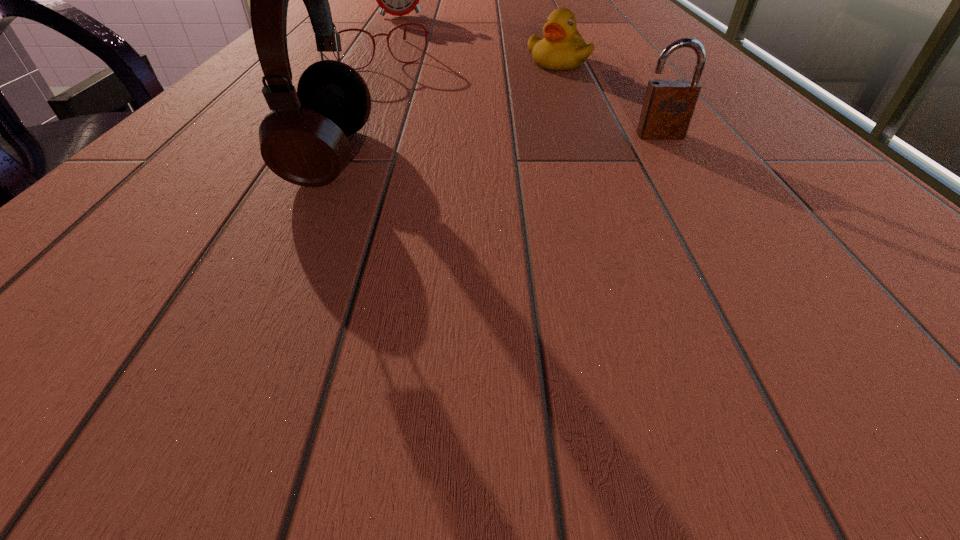
Locate an element on the screen. This screenshot has height=540, width=960. object that is at the right edge is located at coordinates (669, 104).

Locate an element on the screen. vacant space at the far edge of the desktop is located at coordinates (574, 3).

The image size is (960, 540). In the image, there is a desktop. In order to click on vacant space at the near edge in this screenshot , I will do `click(235, 255)`.

At what (x,y) coordinates should I click in order to perform the action: click on free space at the left edge of the desktop. Please return your answer as a coordinate pair (x, y). This screenshot has height=540, width=960. Looking at the image, I should click on (134, 191).

In the image, there is a desktop. Where is `vacant space at the right edge`? vacant space at the right edge is located at coordinates (763, 118).

At what (x,y) coordinates should I click in order to perform the action: click on empty space between the shortest object and the padlock. Please return your answer as a coordinate pair (x, y). The height and width of the screenshot is (540, 960). Looking at the image, I should click on (516, 96).

I want to click on unoccupied position between the shortest object and the second object from right to left, so click(466, 59).

Locate an element on the screen. The width and height of the screenshot is (960, 540). vacant area that lies between the rightmost object and the alarm clock is located at coordinates (531, 76).

The width and height of the screenshot is (960, 540). I want to click on vacant space in between the fourth tallest object and the rightmost object, so click(610, 98).

Locate an element on the screen. Image resolution: width=960 pixels, height=540 pixels. free space that is in between the duckling and the tallest object is located at coordinates (444, 109).